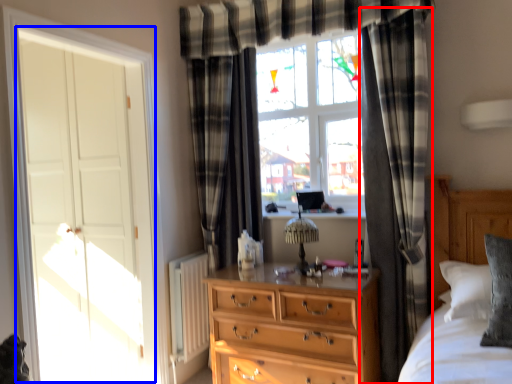
Question: Which of the following is the closest to the observer, curtain (highlighted by a red box) or screen door (highlighted by a blue box)?

Choices:
 (A) curtain
 (B) screen door

Answer: (B)